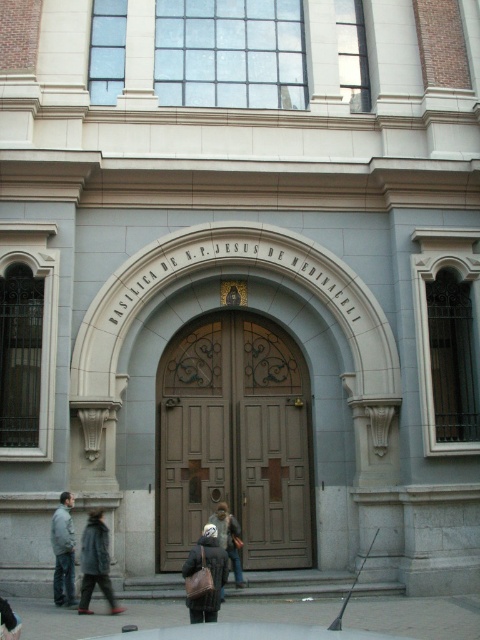
Question: Which point is farther to the camera?

Choices:
 (A) (200, 600)
 (B) (216, 508)
 (C) (182, 516)

Answer: (B)

Question: Can you confirm if brown wooden door at center is positioned to the left of gray fabric jacket at lower left?

Choices:
 (A) no
 (B) yes

Answer: (A)

Question: Is brown wooden door at center in front of dark brown leather coat at center?

Choices:
 (A) yes
 (B) no

Answer: (B)

Question: Does brown wooden door at center come behind dark brown leather coat at center?

Choices:
 (A) yes
 (B) no

Answer: (A)

Question: Which of the following is the closest to the observer?

Choices:
 (A) dark brown leather jacket at center
 (B) dark brown leather coat at center

Answer: (B)

Question: Which object is positioned closest to the brown wooden door at center?

Choices:
 (A) dark brown leather coat at center
 (B) gray fabric jacket at lower left
 (C) dark gray wool coat at lower left

Answer: (B)